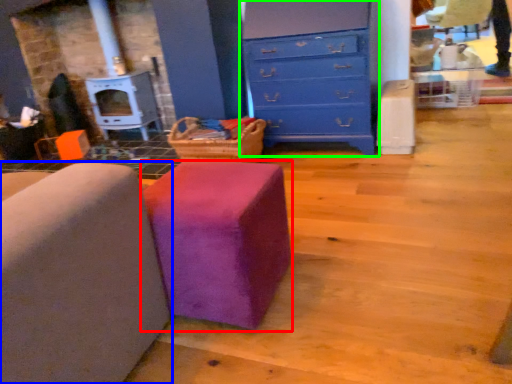
Question: Which object is positioned farthest from furniture (highlighted by a red box)? Select from furniture (highlighted by a blue box) and chest of drawers (highlighted by a green box).

Choices:
 (A) furniture
 (B) chest of drawers

Answer: (B)